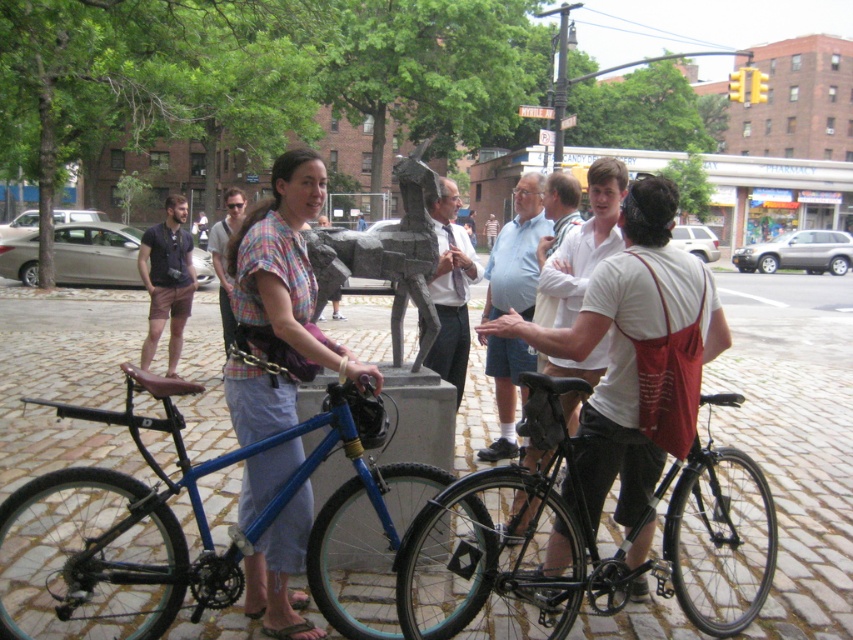
You are a photographer trying to capture a clear shot of both the light blue cotton shirt at center and the light blue shirt at center. Since you want to ensure both are in focus, you need to know which one is wider. Can you determine which one is wider?

The light blue cotton shirt at center is wider than the light blue shirt at center according to the description.

Looking at this image, you are a photographer positioned at point (x=285, y=275) in the image. You want to capture a photo of the plaid fabric shirt at center. Is the plaid fabric shirt at center within your current field of view?

Yes, the plaid fabric shirt at center is located exactly at point (x=285, y=275), so it is directly in your field of view as you are positioned there.